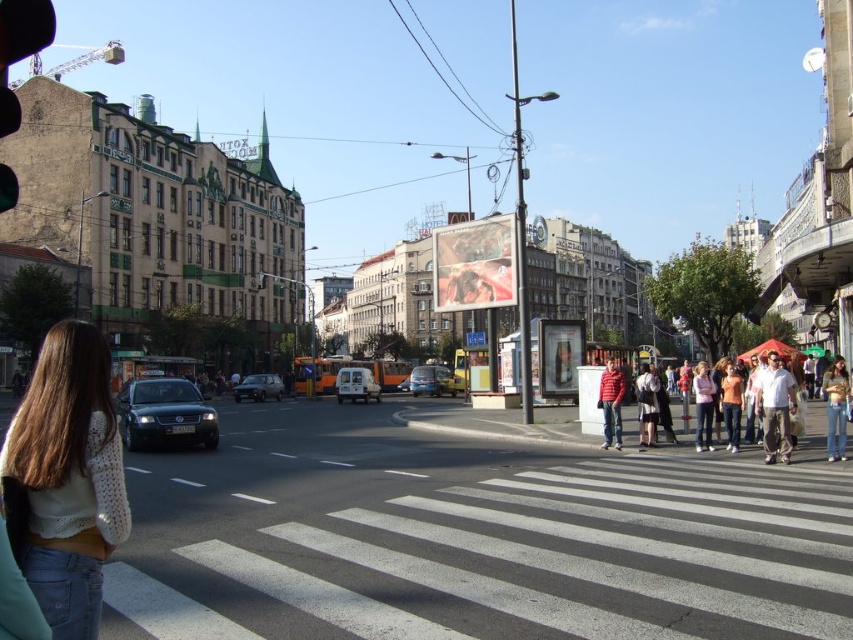
Between pink fabric jacket at lower right and orange matte shirt at center, which one is positioned higher?

Positioned higher is pink fabric jacket at lower right.

Can you confirm if pink fabric jacket at lower right is positioned to the right of orange matte shirt at center?

Indeed, pink fabric jacket at lower right is positioned on the right side of orange matte shirt at center.

Does point (698, 416) come farther from viewer compared to point (724, 419)?

Yes, point (698, 416) is farther from viewer.

Locate an element on the screen. The height and width of the screenshot is (640, 853). pink fabric jacket at lower right is located at coordinates (703, 406).

Is white knitted sweater at lower left bigger than light brown leather jacket at center?

Actually, white knitted sweater at lower left might be smaller than light brown leather jacket at center.

Is point (57, 515) positioned before point (654, 422)?

Yes, point (57, 515) is closer to viewer.

Who is more forward, (45, 449) or (646, 368)?

Point (45, 449) is more forward.

The width and height of the screenshot is (853, 640). What are the coordinates of `white knitted sweater at lower left` in the screenshot? It's located at (65, 480).

From the picture: Does white knitted sweater at lower left appear over pink fabric jacket at lower right?

Indeed, white knitted sweater at lower left is positioned over pink fabric jacket at lower right.

Is white knitted sweater at lower left below pink fabric jacket at lower right?

No.

What do you see at coordinates (65, 480) in the screenshot?
I see `white knitted sweater at lower left` at bounding box center [65, 480].

Find the location of a particular element. The image size is (853, 640). white knitted sweater at lower left is located at coordinates (65, 480).